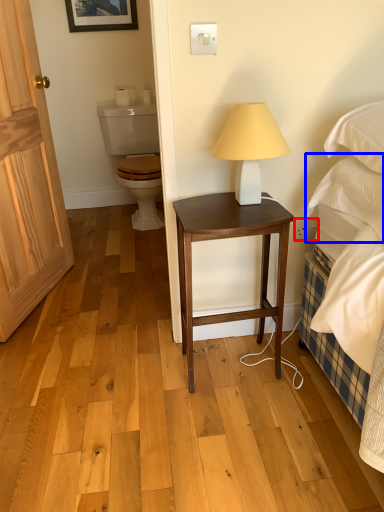
Question: Which object is closer to the camera taking this photo, power outlet (highlighted by a red box) or pillow (highlighted by a blue box)?

Choices:
 (A) power outlet
 (B) pillow

Answer: (B)